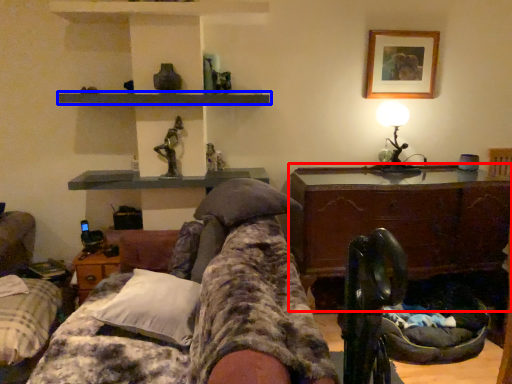
Question: Among these objects, which one is farthest to the camera, table (highlighted by a red box) or shelf (highlighted by a blue box)?

Choices:
 (A) table
 (B) shelf

Answer: (A)